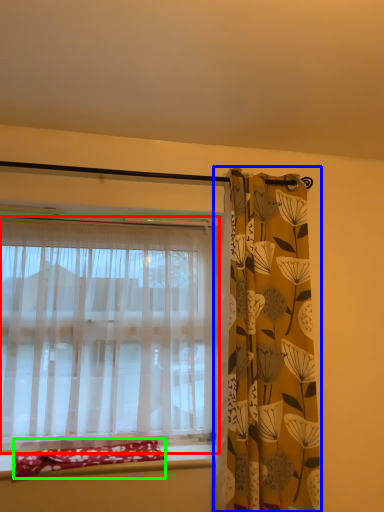
Question: Based on their relative distances, which object is nearer to curtain (highlighted by a red box)? Choose from curtain (highlighted by a blue box) and material (highlighted by a green box).

Choices:
 (A) curtain
 (B) material

Answer: (B)